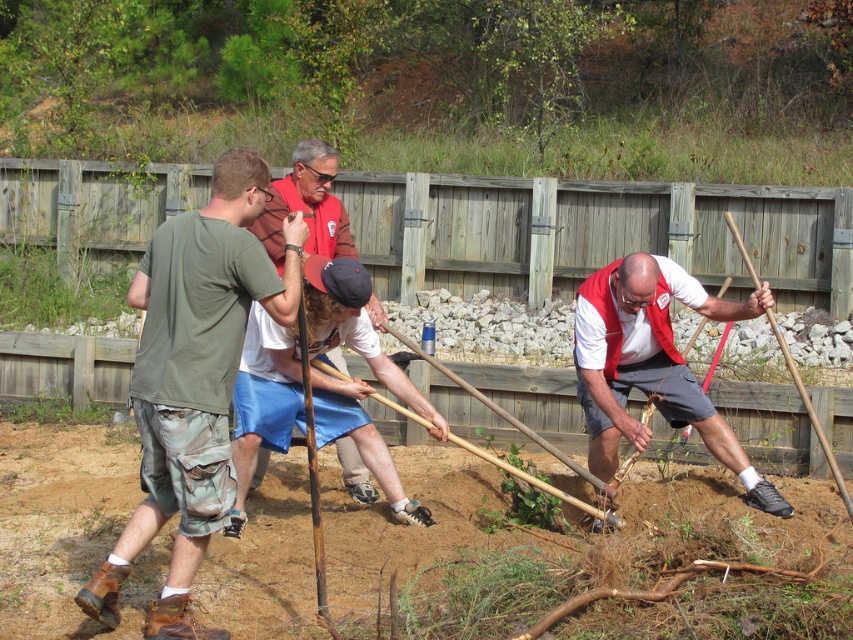
Which of these two, green camo shorts at left or red shirt at center, stands taller?

Standing taller between the two is green camo shorts at left.

The width and height of the screenshot is (853, 640). Describe the element at coordinates (194, 378) in the screenshot. I see `green camo shorts at left` at that location.

Does point (148, 333) come farther from viewer compared to point (315, 179)?

No, (148, 333) is closer to viewer.

I want to click on green camo shorts at left, so click(194, 378).

Consider the image. Which is below, white matte vest at center or red shirt at center?

white matte vest at center

Can you confirm if white matte vest at center is wider than red shirt at center?

Yes, white matte vest at center is wider than red shirt at center.

Is point (630, 316) less distant than point (334, 356)?

Yes.

Where is `white matte vest at center`? white matte vest at center is located at coordinates (x=653, y=364).

Which of these two, green camo shorts at left or white matte vest at center, stands taller?

green camo shorts at left

Who is lower down, green camo shorts at left or white matte vest at center?

white matte vest at center is lower down.

Who is more distant from viewer, (135, 280) or (607, 296)?

Positioned behind is point (607, 296).

You are a GUI agent. You are given a task and a screenshot of the screen. Output one action in this format:
    pyautogui.click(x=<x>, y=<y>)
    Task: Click on the green camo shorts at left
    The width and height of the screenshot is (853, 640).
    Given the screenshot: What is the action you would take?
    pyautogui.click(x=194, y=378)